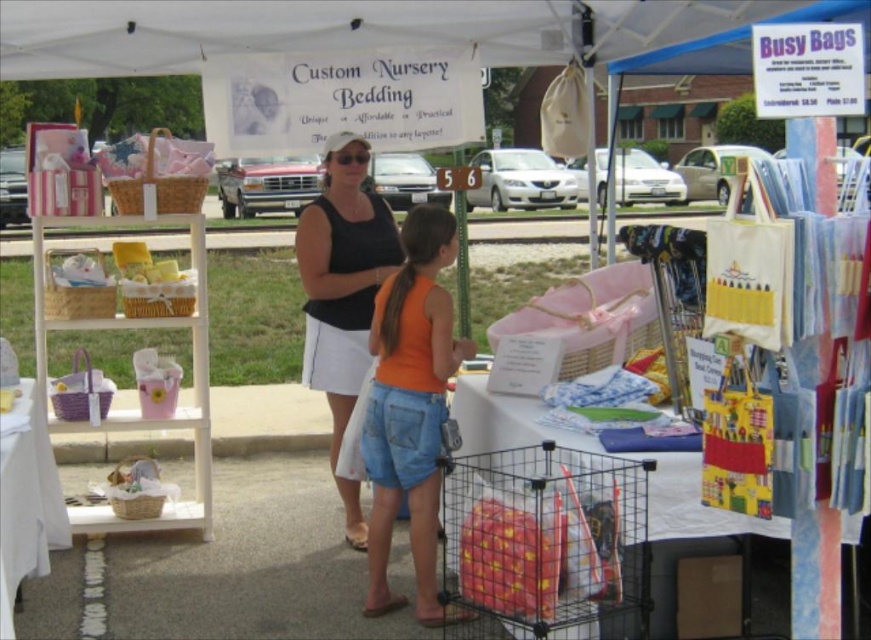
Between point (416, 612) and point (360, 330), which one is positioned in front?

Point (416, 612) is in front.

The image size is (871, 640). Describe the element at coordinates (410, 406) in the screenshot. I see `orange denim shorts at center` at that location.

Locate an element on the screen. Image resolution: width=871 pixels, height=640 pixels. orange denim shorts at center is located at coordinates (410, 406).

Does metallic wire shopping cart at center appear under black matte tank top at center?

Correct, metallic wire shopping cart at center is located below black matte tank top at center.

Is metallic wire shopping cart at center bigger than black matte tank top at center?

No.

Is point (555, 512) in front of point (296, 250)?

That is True.

Identify the location of metallic wire shopping cart at center. Image resolution: width=871 pixels, height=640 pixels. (545, 538).

Which is more to the left, metallic wire shopping cart at center or orange denim shorts at center?

orange denim shorts at center is more to the left.

Is metallic wire shopping cart at center taller than orange denim shorts at center?

In fact, metallic wire shopping cart at center may be shorter than orange denim shorts at center.

Is point (592, 515) behind point (375, 390)?

No, (592, 515) is in front of (375, 390).

Identify the location of metallic wire shopping cart at center. (545, 538).